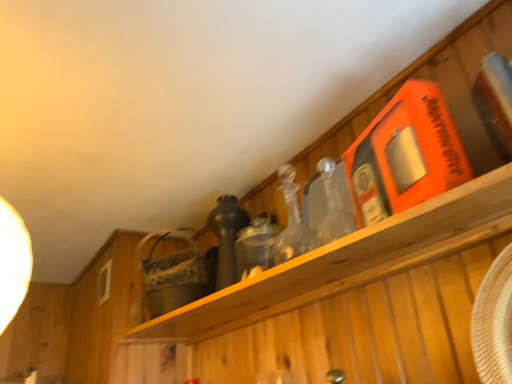
Question: Considering the relative sizes of woven straw basket at center and shiny dark glass bottle at center in the image provided, is woven straw basket at center bigger than shiny dark glass bottle at center?

Choices:
 (A) yes
 (B) no

Answer: (A)

Question: From a real-world perspective, is woven straw basket at center on shiny dark glass bottle at center?

Choices:
 (A) no
 (B) yes

Answer: (B)

Question: Considering the relative positions of woven straw basket at center and shiny dark glass bottle at center in the image provided, is woven straw basket at center in front of shiny dark glass bottle at center?

Choices:
 (A) yes
 (B) no

Answer: (B)

Question: From the image's perspective, would you say woven straw basket at center is positioned over shiny dark glass bottle at center?

Choices:
 (A) no
 (B) yes

Answer: (A)

Question: From the image's perspective, is woven straw basket at center under shiny dark glass bottle at center?

Choices:
 (A) no
 (B) yes

Answer: (B)

Question: Is woven straw basket at center to the right of shiny dark glass bottle at center from the viewer's perspective?

Choices:
 (A) no
 (B) yes

Answer: (A)

Question: Considering the relative positions of shiny dark glass bottle at center and woven straw basket at center in the image provided, is shiny dark glass bottle at center to the right of woven straw basket at center from the viewer's perspective?

Choices:
 (A) yes
 (B) no

Answer: (A)

Question: Does shiny dark glass bottle at center have a greater height compared to woven straw basket at center?

Choices:
 (A) yes
 (B) no

Answer: (B)

Question: From the image's perspective, is shiny dark glass bottle at center on top of woven straw basket at center?

Choices:
 (A) yes
 (B) no

Answer: (A)

Question: Is woven straw basket at center surrounded by shiny dark glass bottle at center?

Choices:
 (A) no
 (B) yes

Answer: (A)

Question: Is shiny dark glass bottle at center in front of woven straw basket at center?

Choices:
 (A) yes
 (B) no

Answer: (A)

Question: Is shiny dark glass bottle at center next to woven straw basket at center and touching it?

Choices:
 (A) no
 (B) yes

Answer: (A)

Question: Based on their sizes in the image, would you say woven straw basket at center is bigger or smaller than shiny dark glass bottle at center?

Choices:
 (A) big
 (B) small

Answer: (A)